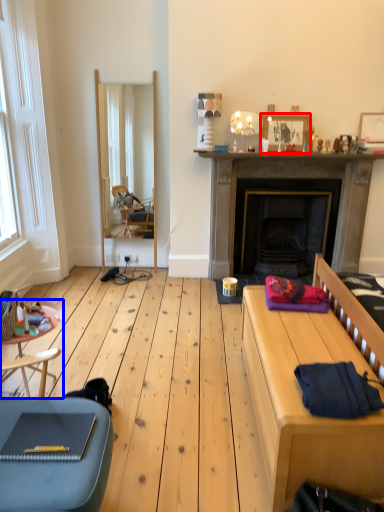
Question: Which of the following is the closest to the observer, picture frame (highlighted by a red box) or side table (highlighted by a blue box)?

Choices:
 (A) picture frame
 (B) side table

Answer: (B)